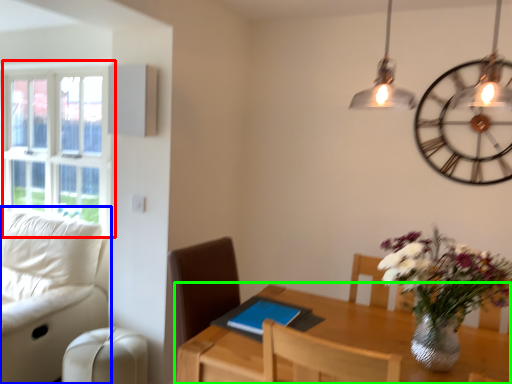
Question: Which object is positioned farthest from window (highlighted by a red box)? Select from studio couch (highlighted by a blue box) and table (highlighted by a green box).

Choices:
 (A) studio couch
 (B) table

Answer: (B)